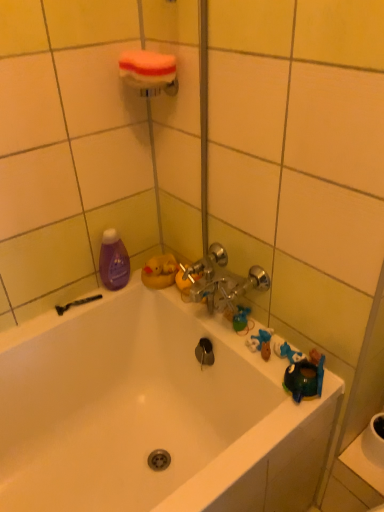
Question: From a real-world perspective, is white foam sponge at upper center below white glossy sink at lower right?

Choices:
 (A) no
 (B) yes

Answer: (A)

Question: Does white foam sponge at upper center have a larger size compared to white glossy sink at lower right?

Choices:
 (A) no
 (B) yes

Answer: (B)

Question: From a real-world perspective, is white foam sponge at upper center positioned over white glossy sink at lower right based on gravity?

Choices:
 (A) no
 (B) yes

Answer: (B)

Question: Is white foam sponge at upper center not close to white glossy sink at lower right?

Choices:
 (A) yes
 (B) no

Answer: (A)

Question: Is white foam sponge at upper center at the left side of white glossy sink at lower right?

Choices:
 (A) no
 (B) yes

Answer: (B)

Question: Can you confirm if white foam sponge at upper center is wider than white glossy sink at lower right?

Choices:
 (A) no
 (B) yes

Answer: (A)

Question: Is white glossy sink at lower right facing towards purple glossy bottle at left?

Choices:
 (A) yes
 (B) no

Answer: (B)

Question: Could purple glossy bottle at left be considered to be inside white glossy sink at lower right?

Choices:
 (A) yes
 (B) no

Answer: (B)

Question: Is white glossy sink at lower right positioned beyond the bounds of purple glossy bottle at left?

Choices:
 (A) no
 (B) yes

Answer: (B)

Question: From a real-world perspective, is white glossy sink at lower right positioned under purple glossy bottle at left based on gravity?

Choices:
 (A) yes
 (B) no

Answer: (A)

Question: From the image's perspective, is white glossy sink at lower right on purple glossy bottle at left?

Choices:
 (A) no
 (B) yes

Answer: (A)

Question: Considering the relative sizes of white glossy sink at lower right and purple glossy bottle at left in the image provided, is white glossy sink at lower right shorter than purple glossy bottle at left?

Choices:
 (A) yes
 (B) no

Answer: (A)

Question: Considering the relative positions of white glossy bathtub at center and purple glossy bottle at left in the image provided, is white glossy bathtub at center to the left of purple glossy bottle at left from the viewer's perspective?

Choices:
 (A) yes
 (B) no

Answer: (B)